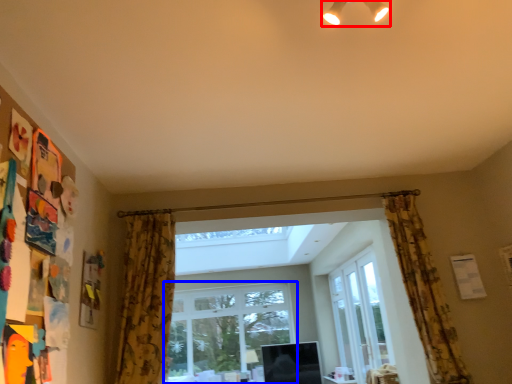
Question: Among these objects, which one is farthest to the camera, light fixture (highlighted by a red box) or window (highlighted by a blue box)?

Choices:
 (A) light fixture
 (B) window

Answer: (B)